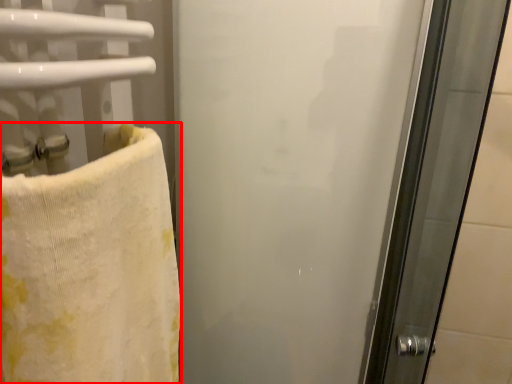
Question: Considering the relative positions of towel (annotated by the red box) and screen door in the image provided, where is towel (annotated by the red box) located with respect to the staircase?

Choices:
 (A) right
 (B) left

Answer: (B)